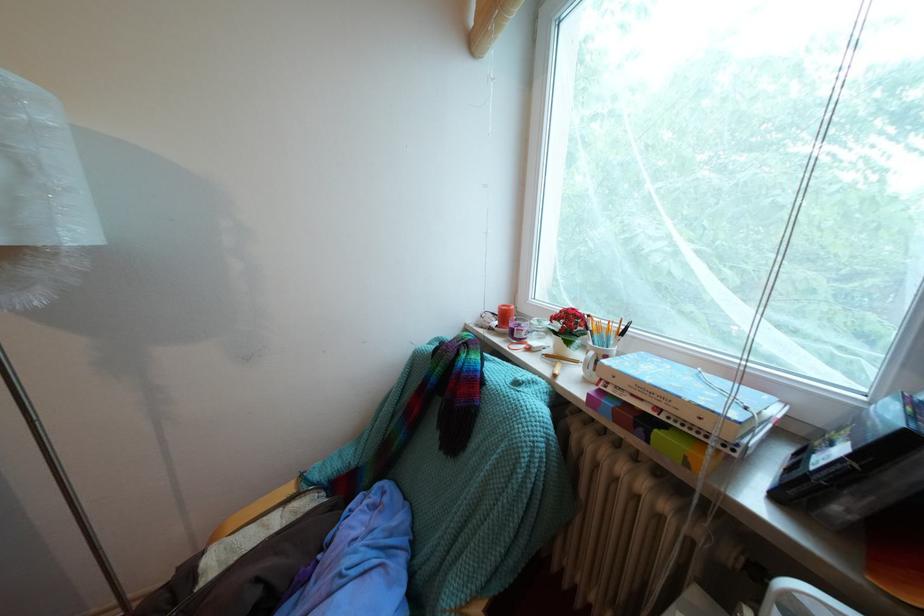
Find where to pull the blind pull cord. Please return your answer as a coordinate pair (x, y).

(798, 198)